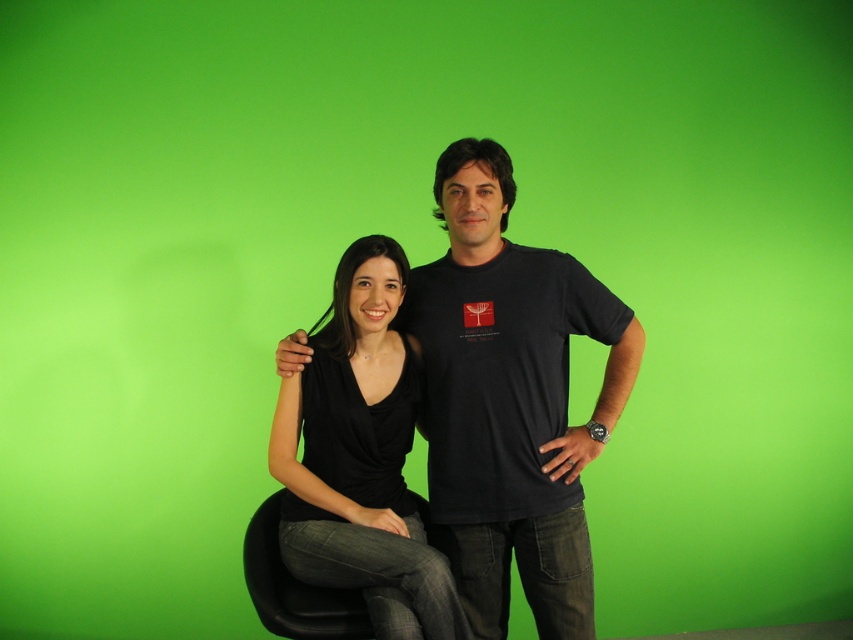
You are a photographer adjusting the lighting for a photo shoot. You need to ensure that the black matte t shirt at center is properly lit. Which object in the scene is closest to the point marked at (509, 400)?

The point marked at (509, 400) corresponds to the black matte t shirt at center, so it is closest to the black matte t shirt at center.